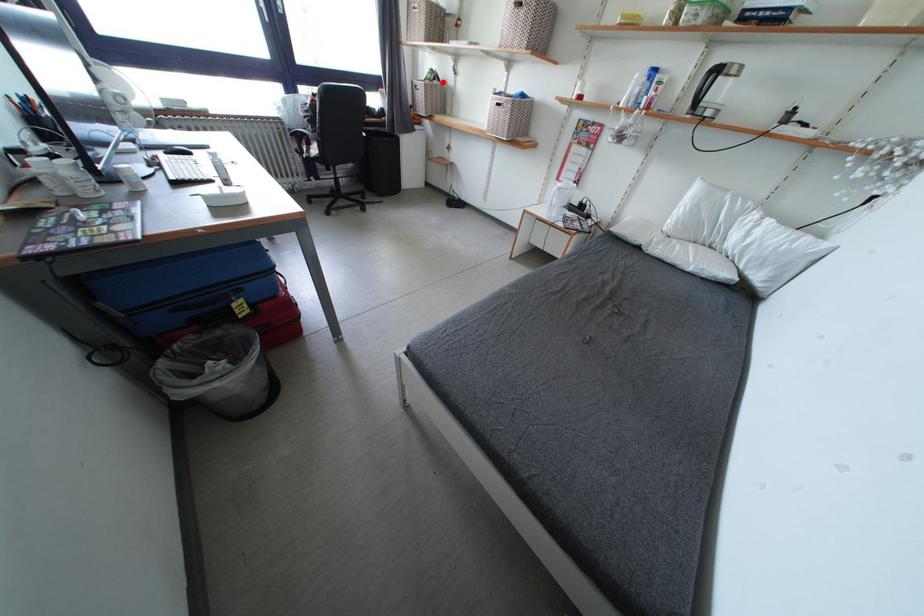
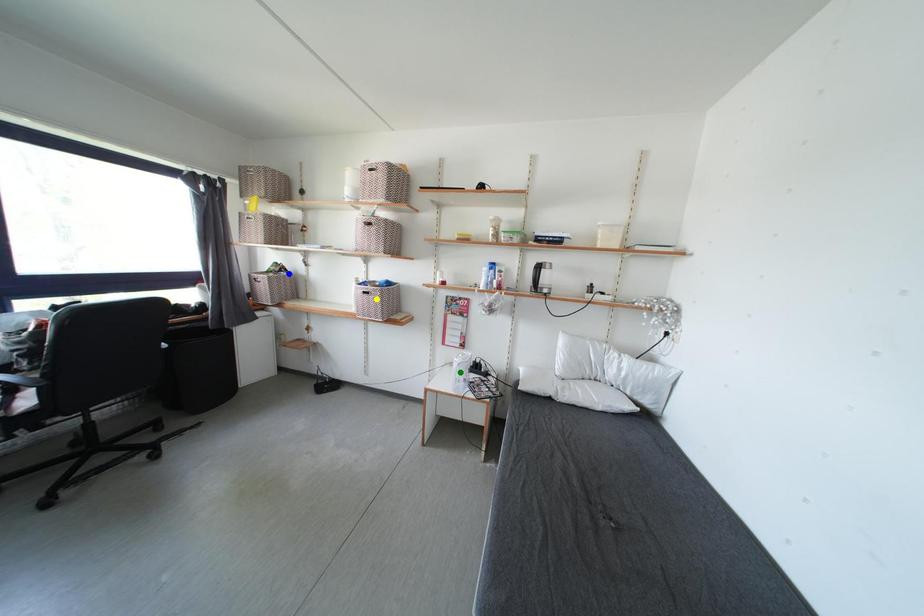
Question: I am providing you with two images of the same scene from different viewpoints. A red point is marked on the first image. You are given multiple points on the second image. Which mark in image 2 goes with the point in image 1?

Choices:
 (A) blue point
 (B) green point
 (C) yellow point

Answer: (A)